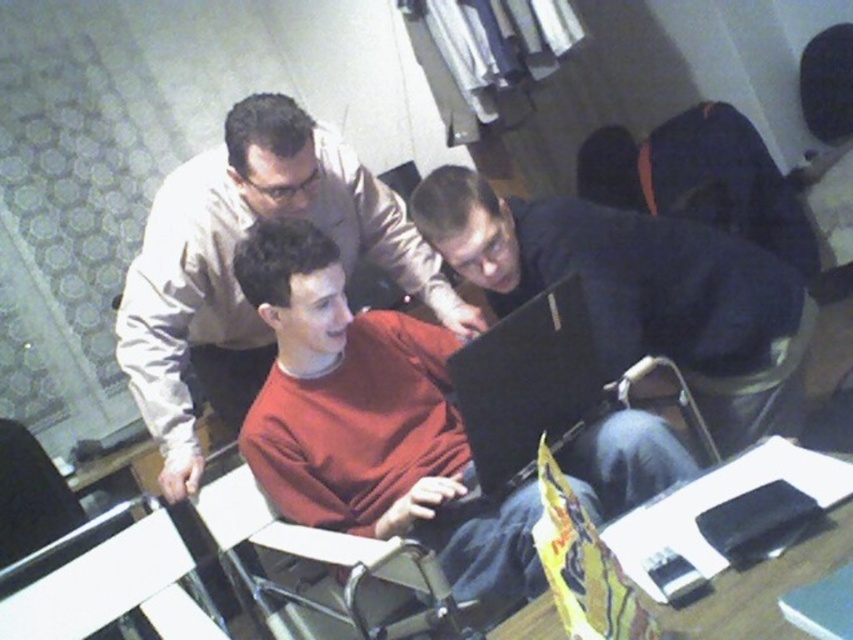
Question: Which of the following is the farthest from the observer?

Choices:
 (A) (624, 396)
 (B) (410, 243)
 (C) (418, 348)

Answer: (B)

Question: Is black glossy laptop at center closer to camera compared to white plastic chair at lower left?

Choices:
 (A) yes
 (B) no

Answer: (A)

Question: Considering the relative positions of matte red sweater at center and white plastic chair at lower left in the image provided, where is matte red sweater at center located with respect to white plastic chair at lower left?

Choices:
 (A) below
 (B) above

Answer: (B)

Question: Which point appears closest to the camera in this image?

Choices:
 (A) (213, 372)
 (B) (49, 476)
 (C) (573, 342)

Answer: (C)

Question: Is matte red sweater at center smaller than matte beige shirt at center?

Choices:
 (A) yes
 (B) no

Answer: (A)

Question: Which is nearer to the brown leather chair at lower right?

Choices:
 (A) white plastic chair at lower left
 (B) matte red sweater at center
 (C) matte beige shirt at center
 (D) black glossy laptop at center

Answer: (D)